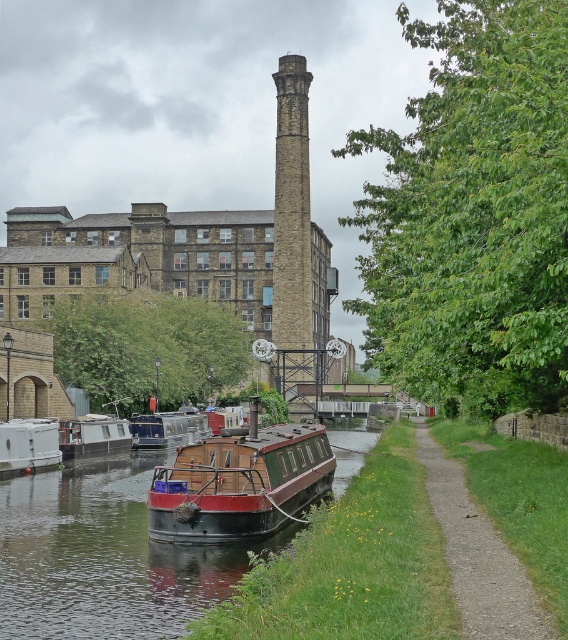
Consider the image. Which of these two, wooden polished barge at center or white matte boat at lower left, stands shorter?

white matte boat at lower left

This screenshot has width=568, height=640. What do you see at coordinates (240, 484) in the screenshot?
I see `wooden polished barge at center` at bounding box center [240, 484].

At what (x,y) coordinates should I click in order to perform the action: click on wooden polished barge at center. Please return your answer as a coordinate pair (x, y). Looking at the image, I should click on (240, 484).

How much distance is there between stone brick tower at center and white matte boat at lower left?

stone brick tower at center is 256.44 feet from white matte boat at lower left.

Which is more to the right, stone brick tower at center or white matte boat at lower left?

stone brick tower at center

The width and height of the screenshot is (568, 640). I want to click on stone brick tower at center, so click(x=295, y=244).

Can you confirm if stone brick tower at center is bigger than wooden boat at center?

Indeed, stone brick tower at center has a larger size compared to wooden boat at center.

Who is shorter, stone brick tower at center or wooden boat at center?

wooden boat at center

Describe the element at coordinates (295, 244) in the screenshot. The height and width of the screenshot is (640, 568). I see `stone brick tower at center` at that location.

Image resolution: width=568 pixels, height=640 pixels. I want to click on stone brick tower at center, so click(295, 244).